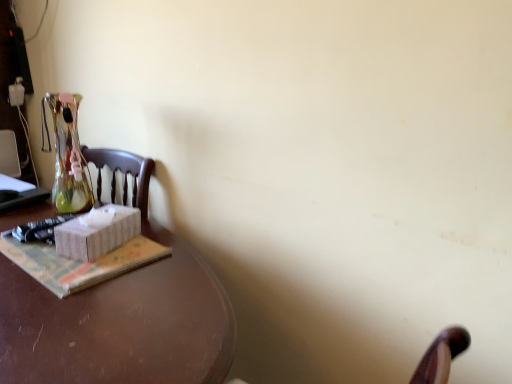
The width and height of the screenshot is (512, 384). What do you see at coordinates (97, 232) in the screenshot?
I see `white wicker box at left` at bounding box center [97, 232].

This screenshot has height=384, width=512. What do you see at coordinates (120, 324) in the screenshot?
I see `brown polished wood desk at left` at bounding box center [120, 324].

At what (x,y) coordinates should I click in order to perform the action: click on white wicker box at left. Please return your answer as a coordinate pair (x, y). The width and height of the screenshot is (512, 384). Looking at the image, I should click on (97, 232).

From the image's perspective, between brown polished wood desk at left and white paper at left, who is located below?

brown polished wood desk at left.

Which of these two, brown polished wood desk at left or white paper at left, is smaller?

white paper at left.

Does brown polished wood desk at left have a lesser height compared to white paper at left?

No, brown polished wood desk at left is not shorter than white paper at left.

How different are the orientations of brown polished wood desk at left and white paper at left in degrees?

They differ by 2.48 degrees in their facing directions.

Is white wicker box at left next to white paper at left and touching it?

Yes, white wicker box at left is in contact with white paper at left.

Does white wicker box at left lie in front of white paper at left?

No, it is not.

Considering the positions of objects white wicker box at left and white paper at left in the image provided, who is more to the left, white wicker box at left or white paper at left?

Positioned to the left is white paper at left.

Is white wicker box at left not within white paper at left?

Yes, white wicker box at left is not within white paper at left.

Is point (210, 333) closer or farther from the camera than point (113, 245)?

Point (210, 333).

Which of these two, brown polished wood desk at left or white wicker box at left, stands taller?

With more height is brown polished wood desk at left.

Does brown polished wood desk at left appear on the right side of white wicker box at left?

No, brown polished wood desk at left is not to the right of white wicker box at left.

How distant is brown polished wood desk at left from white wicker box at left?

brown polished wood desk at left and white wicker box at left are 8.39 inches apart.

Is the position of white wicker box at left less distant than that of brown polished wood desk at left?

No, it is not.

How far apart are white wicker box at left and brown polished wood desk at left?

They are 8.39 inches apart.

How different are the orientations of white wicker box at left and brown polished wood desk at left in degrees?

The facing directions of white wicker box at left and brown polished wood desk at left are 17.4 degrees apart.

Is white wicker box at left bigger or smaller than brown polished wood desk at left?

white wicker box at left is smaller than brown polished wood desk at left.

Image resolution: width=512 pixels, height=384 pixels. Find the location of `paperback book behind the brown polished wood desk at left`. paperback book behind the brown polished wood desk at left is located at coordinates (78, 263).

Which is behind, white paper at left or brown polished wood desk at left?

Positioned behind is white paper at left.

Is point (39, 255) in front of point (185, 299)?

No, (39, 255) is further to viewer.

Looking at their sizes, would you say white paper at left is wider or thinner than brown polished wood desk at left?

Considering their sizes, white paper at left looks slimmer than brown polished wood desk at left.

Would you say white paper at left contains white wicker box at left?

No, white wicker box at left is not surrounded by white paper at left.

Which of these two, white paper at left or white wicker box at left, is thinner?

white wicker box at left.

Is white paper at left positioned with its back to white wicker box at left?

white paper at left does not have its back to white wicker box at left.

Locate an element on the screen. The width and height of the screenshot is (512, 384). paperback book below the white wicker box at left (from the image's perspective) is located at coordinates (78, 263).

You are a GUI agent. You are given a task and a screenshot of the screen. Output one action in this format:
    pyautogui.click(x=<x>, y=<y>)
    Task: Click on the desk on the left of white paper at left
    This screenshot has width=512, height=384.
    Given the screenshot: What is the action you would take?
    pyautogui.click(x=120, y=324)

This screenshot has height=384, width=512. I want to click on paperback book directly beneath the white wicker box at left (from a real-world perspective), so click(x=78, y=263).

Estimate the real-world distances between objects in this image. Which object is further from white paper at left, white wicker box at left or brown polished wood desk at left?

brown polished wood desk at left is further to white paper at left.

Based on their spatial positions, is brown polished wood desk at left or white paper at left closer to white wicker box at left?

white paper at left is closer to white wicker box at left.

Based on the photo, from the image, which object appears to be farther from brown polished wood desk at left, white wicker box at left or white paper at left?

Based on the image, white wicker box at left appears to be further to brown polished wood desk at left.

Estimate the real-world distances between objects in this image. Which object is closer to white wicker box at left, white paper at left or brown polished wood desk at left?

white paper at left is positioned closer to the anchor white wicker box at left.

Estimate the real-world distances between objects in this image. Which object is closer to brown polished wood desk at left, white paper at left or white wicker box at left?

white paper at left.

Which object lies further to the anchor point white paper at left, brown polished wood desk at left or white wicker box at left?

The object further to white paper at left is brown polished wood desk at left.

You are a GUI agent. You are given a task and a screenshot of the screen. Output one action in this format:
    pyautogui.click(x=<x>, y=<y>)
    Task: Click on the paperback book positioned between brown polished wood desk at left and white wicker box at left from near to far
    The height and width of the screenshot is (384, 512).
    Given the screenshot: What is the action you would take?
    pyautogui.click(x=78, y=263)